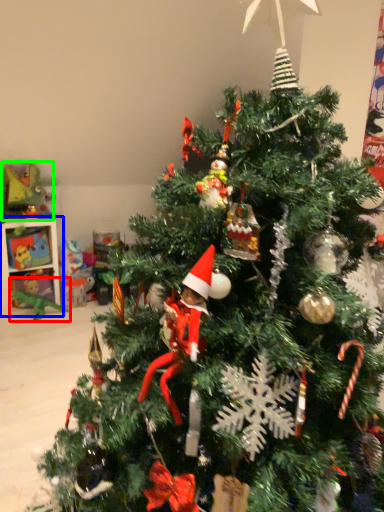
Question: Considering the real-world distances, which object is closest to toy (highlighted by a red box)? shelf (highlighted by a blue box) or toy (highlighted by a green box).

Choices:
 (A) shelf
 (B) toy

Answer: (A)